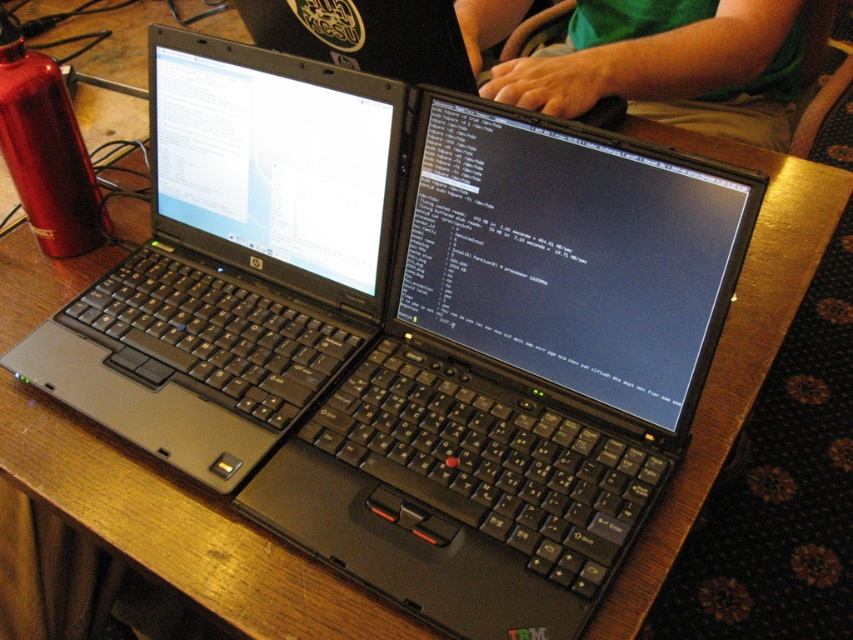
This screenshot has height=640, width=853. Describe the element at coordinates (234, 259) in the screenshot. I see `black plastic laptop at center` at that location.

Between point (175, 220) and point (549, 84), which one is positioned behind?

Point (549, 84)

Locate an element on the screen. black plastic laptop at center is located at coordinates (234, 259).

The image size is (853, 640). I want to click on black plastic laptop at center, so click(234, 259).